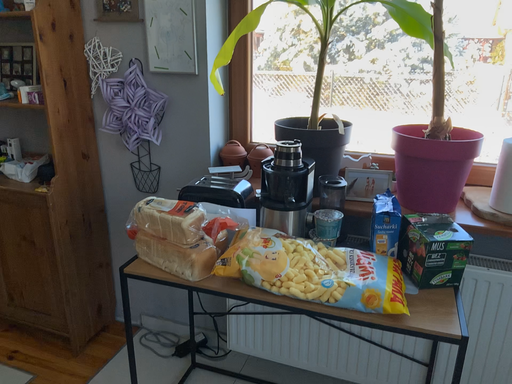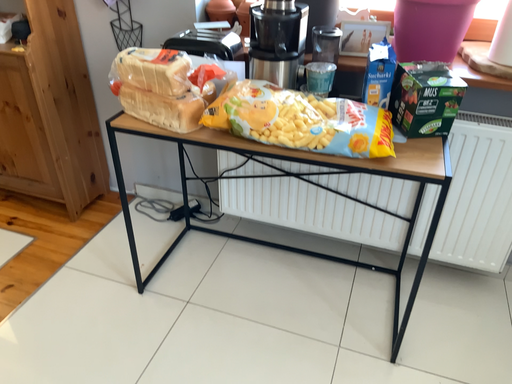
Question: How did the camera likely rotate when shooting the video?

Choices:
 (A) rotated upward
 (B) rotated downward

Answer: (B)